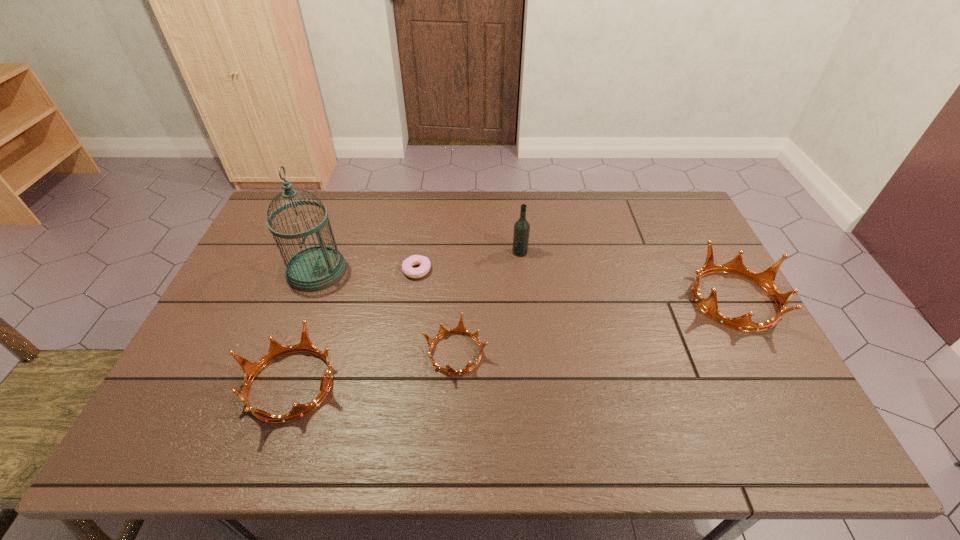
Where is `vacant region between the second object from right to left and the third object from left to right`? Image resolution: width=960 pixels, height=540 pixels. vacant region between the second object from right to left and the third object from left to right is located at coordinates (468, 261).

Where is `free space between the rightmost crown and the birdcage`? Image resolution: width=960 pixels, height=540 pixels. free space between the rightmost crown and the birdcage is located at coordinates pos(525,285).

The width and height of the screenshot is (960, 540). In order to click on free space between the third object from left to right and the birdcage in this screenshot , I will do `click(367, 271)`.

Locate an element on the screen. The height and width of the screenshot is (540, 960). vacant area that lies between the rightmost crown and the birdcage is located at coordinates (525, 285).

This screenshot has height=540, width=960. What are the coordinates of `free point between the second shortest crown and the third object from right to left` in the screenshot? It's located at (373, 369).

What are the coordinates of `the third closest object to the fourth tallest object` in the screenshot? It's located at (x=424, y=262).

Identify the location of object that stands as the third closest to the fourth object from left to right. This screenshot has height=540, width=960. (521, 227).

The width and height of the screenshot is (960, 540). Find the location of `the closest crown to the third shortest object`. the closest crown to the third shortest object is located at coordinates (460, 329).

Locate an element on the screen. crown identified as the closest to the shortest crown is located at coordinates (276, 350).

Identify the location of free space that satisfies the following two spatial constraints: 1. on the back side of the vodka; 2. on the left side of the doughnut. (420, 252).